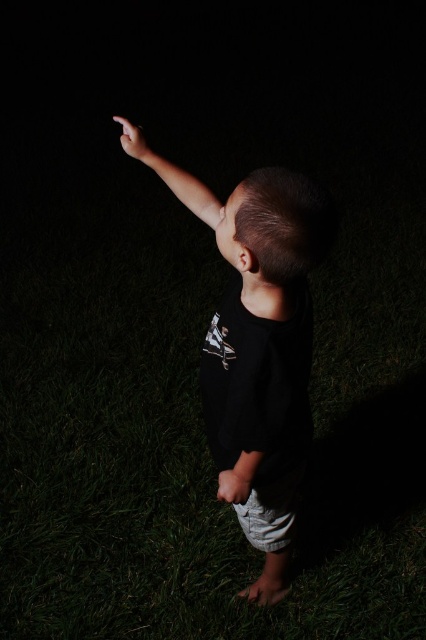
Which is below, black matte shirt at upper center or black matte shirt at center?

black matte shirt at center is below.

Between black matte shirt at upper center and black matte shirt at center, which one appears on the left side from the viewer's perspective?

black matte shirt at upper center

At what (x,y) coordinates should I click in order to perform the action: click on black matte shirt at upper center. Please return your answer as a coordinate pair (x, y). Looking at the image, I should click on (261, 346).

Identify the location of black matte shirt at upper center. (261, 346).

Is black matte shirt at center bigger than white matte hand at lower center?

Correct, black matte shirt at center is larger in size than white matte hand at lower center.

Who is more distant from viewer, (229, 474) or (224, 481)?

Point (224, 481)

Is point (239, 468) closer to camera compared to point (232, 483)?

Yes, it is in front of point (232, 483).

Where is `black matte shirt at center`? Image resolution: width=426 pixels, height=640 pixels. black matte shirt at center is located at coordinates (238, 477).

Is matte black arm at upper left to the left of matte black finger at upper right from the viewer's perspective?

No, matte black arm at upper left is not to the left of matte black finger at upper right.

The width and height of the screenshot is (426, 640). Describe the element at coordinates (172, 176) in the screenshot. I see `matte black arm at upper left` at that location.

Locate an element on the screen. Image resolution: width=426 pixels, height=640 pixels. matte black arm at upper left is located at coordinates point(172,176).